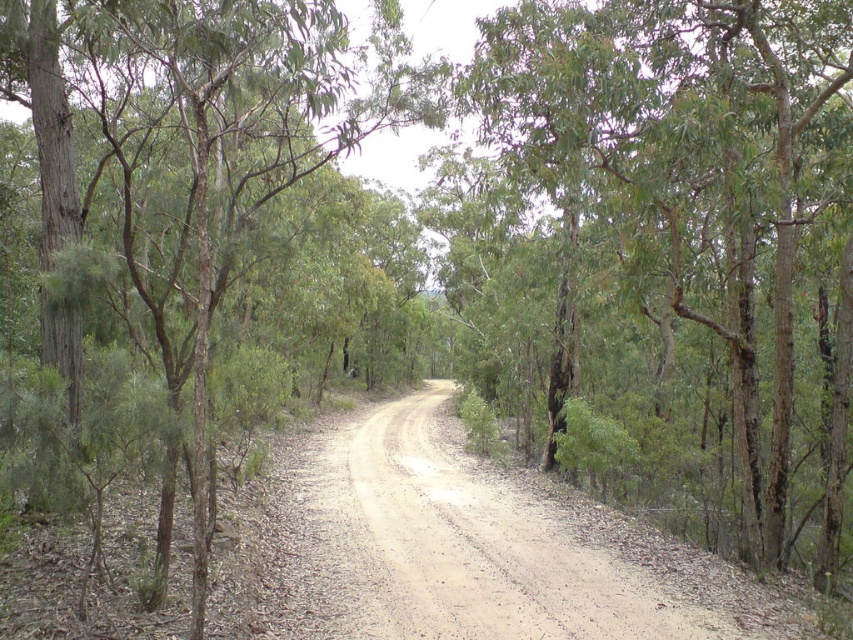
Question: Does green rough bark tree at center come in front of dusty gravel road at center?

Choices:
 (A) yes
 (B) no

Answer: (B)

Question: From the image, what is the correct spatial relationship of dusty gravel road at center in relation to brown rough tree at center?

Choices:
 (A) below
 (B) above

Answer: (A)

Question: Among these objects, which one is farthest from the camera?

Choices:
 (A) green rough bark tree at center
 (B) dusty gravel road at center

Answer: (A)

Question: Based on their relative distances, which object is nearer to the brown rough tree at center?

Choices:
 (A) green rough bark tree at center
 (B) dusty gravel road at center

Answer: (B)

Question: Which object is farther from the camera taking this photo?

Choices:
 (A) green rough bark tree at center
 (B) brown rough tree at center

Answer: (A)

Question: Can you confirm if green rough bark tree at center is wider than brown rough tree at center?

Choices:
 (A) no
 (B) yes

Answer: (B)